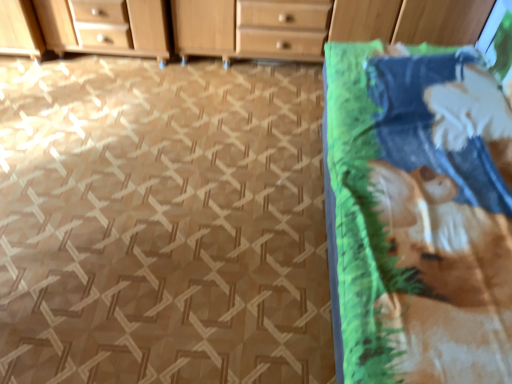
Question: Relative to wooden chest of drawers at upper center, is green fabric at right in front or behind?

Choices:
 (A) behind
 (B) front

Answer: (B)

Question: Considering the relative positions of green fabric at right and wooden chest of drawers at upper center in the image provided, is green fabric at right to the left or to the right of wooden chest of drawers at upper center?

Choices:
 (A) left
 (B) right

Answer: (A)

Question: Which is nearer to the wooden chest of drawers at upper center?

Choices:
 (A) green fabric at right
 (B) printed cotton blanket at right

Answer: (A)

Question: Which object is positioned farthest from the wooden chest of drawers at upper center?

Choices:
 (A) green fabric at right
 (B) printed cotton blanket at right

Answer: (B)